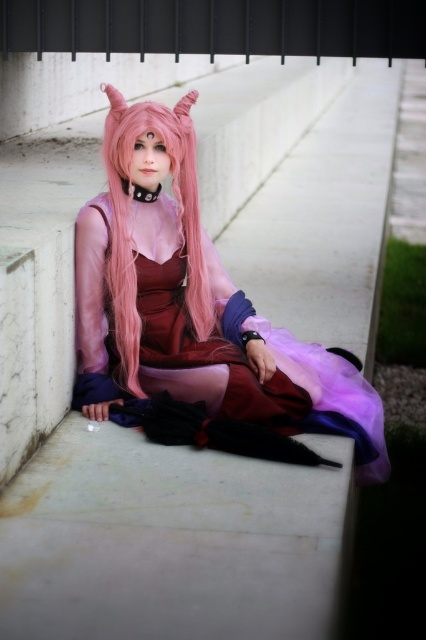
Question: Does satin pink dress at center appear under pink silky hair at center?

Choices:
 (A) no
 (B) yes

Answer: (B)

Question: Which of the following is the closest to the observer?

Choices:
 (A) tap(106, 275)
 (B) tap(302, 408)

Answer: (B)

Question: Does satin pink dress at center appear on the left side of pink silky hair at center?

Choices:
 (A) yes
 (B) no

Answer: (B)

Question: Is satin pink dress at center thinner than pink silky hair at center?

Choices:
 (A) no
 (B) yes

Answer: (A)